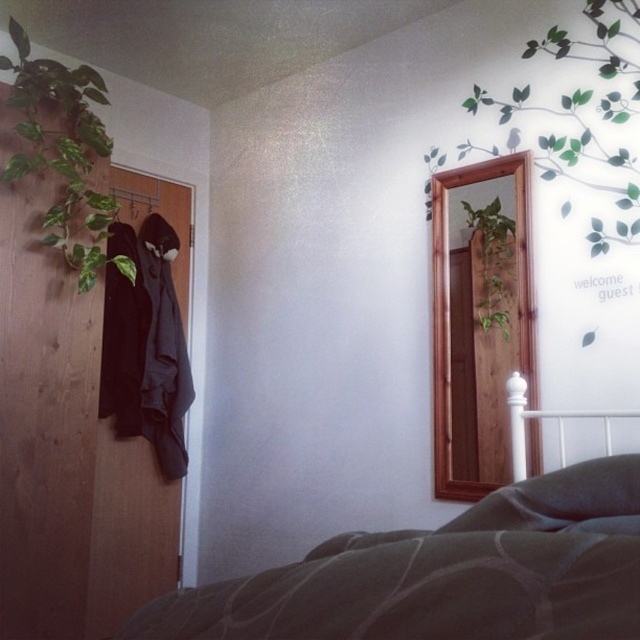
You are standing in the room and want to touch both points. Which point should you reach for first, the point at coordinate (483, 99) or the point at coordinate (51, 145)?

You should reach for point (483, 99) first because it is closer to you than point (51, 145).

You are planning to place a rectangular decorative item on the bed. The item is the same size as the green matte plant at upper left. Will it fit on the dark green textured bedspread at lower center?

The dark green textured bedspread at lower center is wider than the green matte plant at upper left, so the decorative item will fit on the dark green textured bedspread at lower center.

You are standing in the room and want to move from the green matte plant at upper left to the green matte plant at center. Which direction should you move in?

You should move to the right because the green matte plant at upper left is to the left of the green matte plant at center.